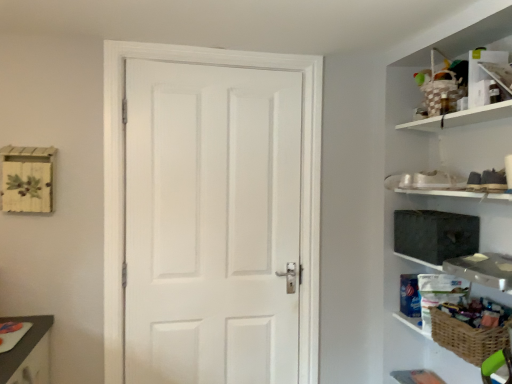
Question: Does dark gray fabric medicine cabinet at right appear on the right side of woven brown basket at lower right?

Choices:
 (A) yes
 (B) no

Answer: (B)

Question: Does dark gray fabric medicine cabinet at right have a smaller size compared to woven brown basket at lower right?

Choices:
 (A) no
 (B) yes

Answer: (A)

Question: Can you confirm if dark gray fabric medicine cabinet at right is shorter than woven brown basket at lower right?

Choices:
 (A) no
 (B) yes

Answer: (A)

Question: Considering the relative sizes of dark gray fabric medicine cabinet at right and woven brown basket at lower right in the image provided, is dark gray fabric medicine cabinet at right wider than woven brown basket at lower right?

Choices:
 (A) yes
 (B) no

Answer: (B)

Question: Is the position of dark gray fabric medicine cabinet at right less distant than that of woven brown basket at lower right?

Choices:
 (A) no
 (B) yes

Answer: (A)

Question: Considering their positions, is white matte door at center located in front of or behind dark gray fabric medicine cabinet at right?

Choices:
 (A) behind
 (B) front

Answer: (A)

Question: Is white matte door at center to the left or to the right of dark gray fabric medicine cabinet at right in the image?

Choices:
 (A) right
 (B) left

Answer: (B)

Question: From their relative heights in the image, would you say white matte door at center is taller or shorter than dark gray fabric medicine cabinet at right?

Choices:
 (A) short
 (B) tall

Answer: (B)

Question: From a real-world perspective, is white matte door at center physically located above or below dark gray fabric medicine cabinet at right?

Choices:
 (A) below
 (B) above

Answer: (A)

Question: From a real-world perspective, is white matte door at center positioned above or below woven wicker basket at right?

Choices:
 (A) above
 (B) below

Answer: (A)

Question: Would you say white matte door at center is to the left or to the right of woven wicker basket at right in the picture?

Choices:
 (A) right
 (B) left

Answer: (B)

Question: Relative to woven wicker basket at right, is white matte door at center in front or behind?

Choices:
 (A) front
 (B) behind

Answer: (B)

Question: Considering the positions of white matte door at center and woven wicker basket at right in the image, is white matte door at center taller or shorter than woven wicker basket at right?

Choices:
 (A) short
 (B) tall

Answer: (B)

Question: Is point (421, 225) closer or farther from the camera than point (195, 246)?

Choices:
 (A) farther
 (B) closer

Answer: (B)

Question: From the image's perspective, is dark gray fabric medicine cabinet at right located above or below white matte door at center?

Choices:
 (A) above
 (B) below

Answer: (A)